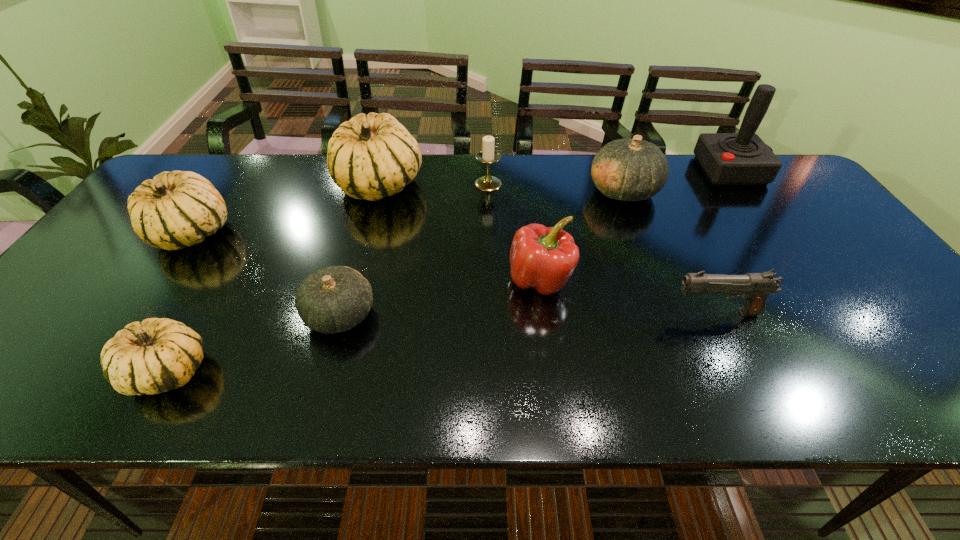
At what (x,y) coordinates should I click in order to perform the action: click on red joystick. Please return your answer as a coordinate pair (x, y). This screenshot has height=540, width=960. Looking at the image, I should click on (742, 158).

Locate an element on the screen. The height and width of the screenshot is (540, 960). the tallest object is located at coordinates (742, 158).

Locate an element on the screen. the biggest white gourd is located at coordinates (373, 156).

Locate an element on the screen. The width and height of the screenshot is (960, 540). the eighth shortest object is located at coordinates coord(373,156).

Locate an element on the screen. Image resolution: width=960 pixels, height=540 pixels. the farther orange gourd is located at coordinates (627, 169).

At what (x,y) coordinates should I click in order to perform the action: click on the bigger orange gourd. Please return your answer as a coordinate pair (x, y). Looking at the image, I should click on (627, 169).

Where is `the second smallest white gourd`? the second smallest white gourd is located at coordinates (176, 209).

Locate an element on the screen. Image resolution: width=960 pixels, height=540 pixels. the fifth object from left to right is located at coordinates (488, 155).

Find the location of a particular element. The width and height of the screenshot is (960, 540). white candle holder is located at coordinates (488, 155).

You are a GUI agent. You are given a task and a screenshot of the screen. Output one action in this format:
    pyautogui.click(x=<x>, y=<y>)
    Task: Click on the pink pepper
    Image resolution: width=960 pixels, height=540 pixels.
    Given the screenshot: What is the action you would take?
    pyautogui.click(x=544, y=258)